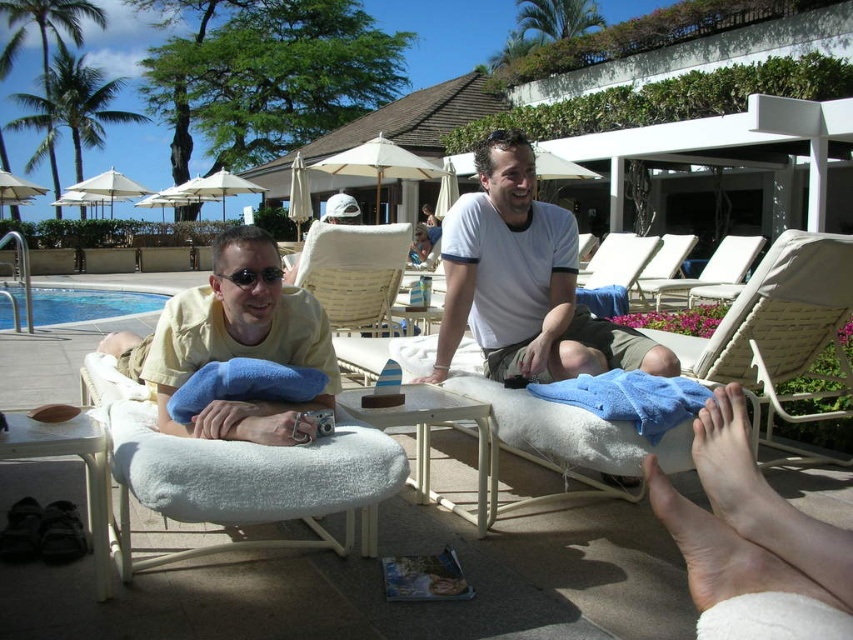
Question: Which object is closer to the camera taking this photo?

Choices:
 (A) matte black sunglasses at center
 (B) pale skin at lower right
 (C) blue glass water at lower left
 (D) beige woven beach chair at center

Answer: (B)

Question: Does pale skin at lower right appear on the left side of white fabric lounge chair at center?

Choices:
 (A) no
 (B) yes

Answer: (B)

Question: Which point is closer to the camera?

Choices:
 (A) white cotton shirt at center
 (B) matte yellow shirt at center
 (C) yellow cotton shirt at left

Answer: (C)

Question: Can you confirm if beige woven beach chair at lower right is thinner than pale skin at lower right?

Choices:
 (A) yes
 (B) no

Answer: (B)

Question: Which point is farther from the camera taking this photo?

Choices:
 (A) (642, 296)
 (B) (558, 246)
 (C) (271, 440)

Answer: (A)

Question: Is the position of yellow cotton shirt at left more distant than that of blue glass water at lower left?

Choices:
 (A) no
 (B) yes

Answer: (A)